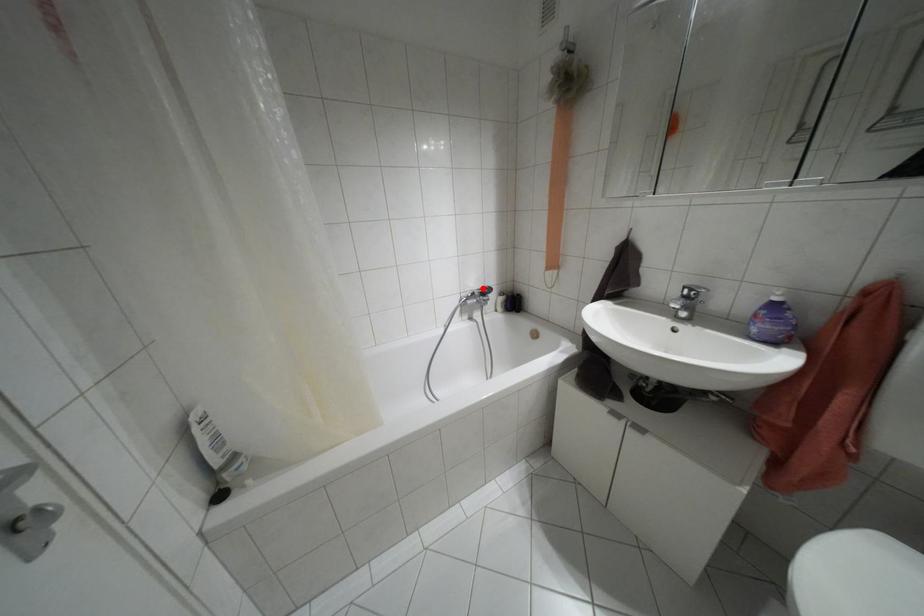
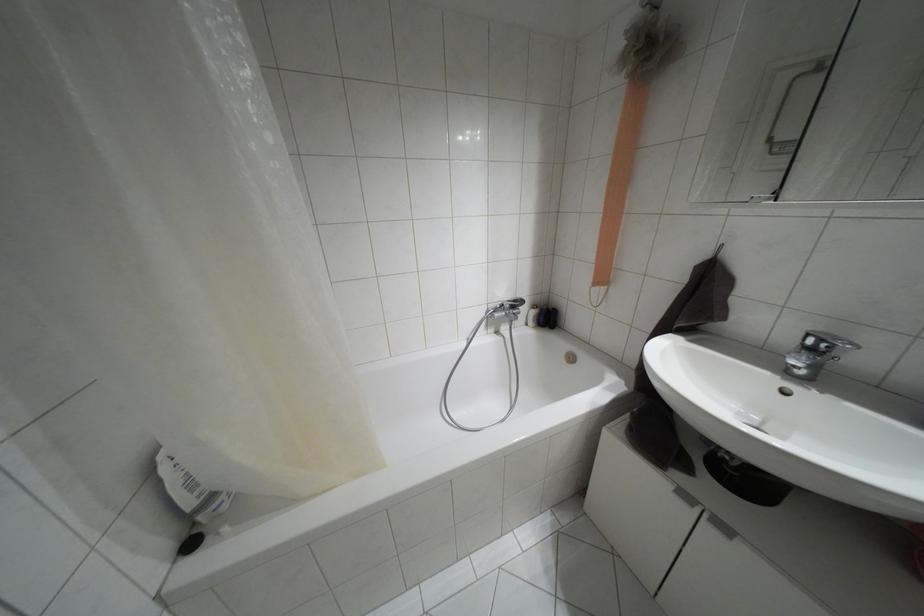
In the second image, find the point that corresponds to the highlighted location in the first image.

(514, 301)